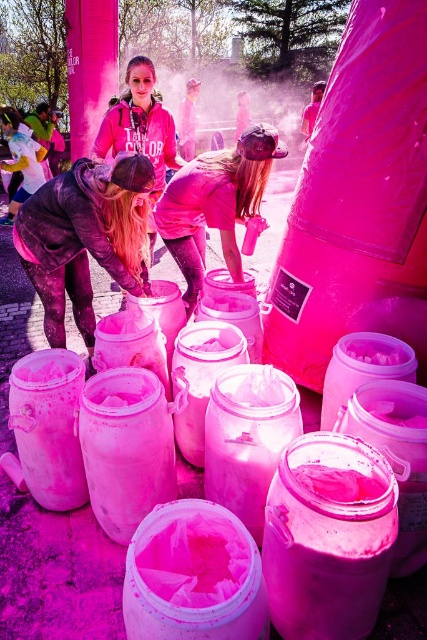
Based on the photo, can you confirm if matte pink bucket at center is bigger than matte pink hoodie at center?

Actually, matte pink bucket at center might be smaller than matte pink hoodie at center.

Does point (251, 125) come farther from viewer compared to point (160, 188)?

No.

Is point (201, 216) behind point (149, 141)?

No.

Find the location of `matte pink bucket at center`. matte pink bucket at center is located at coordinates (215, 204).

At what (x,y) coordinates should I click in order to perform the action: click on matte black jacket at left. Please return your answer as a coordinate pair (x, y). The height and width of the screenshot is (640, 427). Looking at the image, I should click on (84, 237).

What do you see at coordinates (84, 237) in the screenshot? I see `matte black jacket at left` at bounding box center [84, 237].

You are a GUI agent. You are given a task and a screenshot of the screen. Output one action in this format:
    pyautogui.click(x=<x>, y=<y>)
    Task: Click on the matte black jacket at left
    Image resolution: width=427 pixels, height=640 pixels.
    Given the screenshot: What is the action you would take?
    pyautogui.click(x=84, y=237)

Is matte black jacket at left further to the viewer compared to matte pink hoodie at center?

No.

Based on the photo, between matte black jacket at left and matte pink hoodie at center, which one is positioned lower?

matte black jacket at left is lower down.

Locate an element on the screen. This screenshot has width=427, height=640. matte black jacket at left is located at coordinates (84, 237).